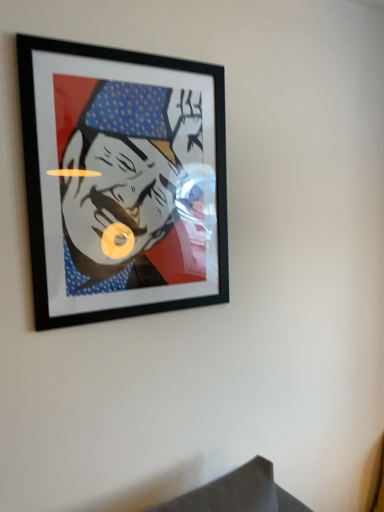
What is the approximate width of matte black picture frame at upper left?

1.29 inches.

I want to click on matte black picture frame at upper left, so click(122, 181).

This screenshot has width=384, height=512. Describe the element at coordinates (122, 181) in the screenshot. I see `matte black picture frame at upper left` at that location.

Identify the location of matte black picture frame at upper left. (122, 181).